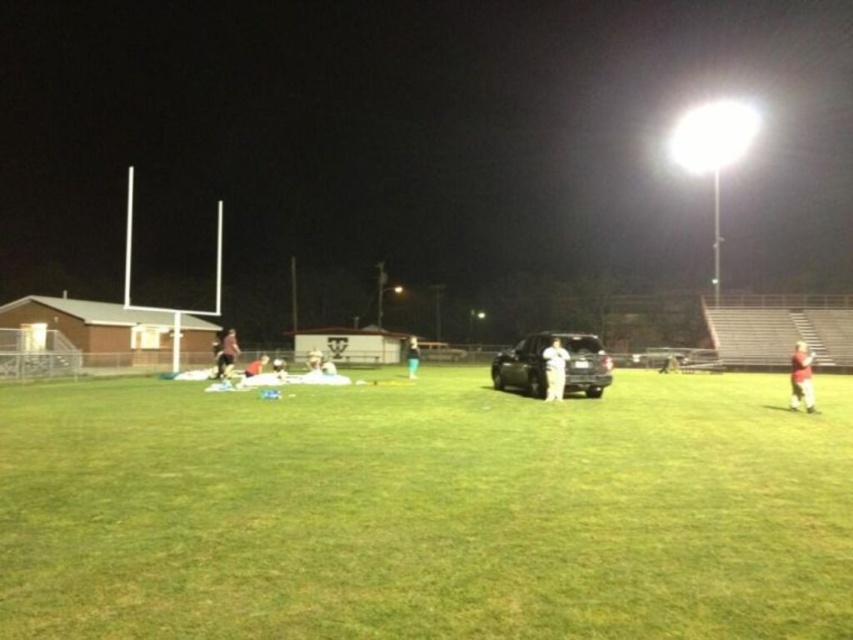
Which is in front, point (467, 48) or point (811, 397)?

Point (811, 397)

Does point (793, 33) come in front of point (799, 390)?

No.

Locate an element on the screen. This screenshot has width=853, height=640. metallic car at center is located at coordinates (416, 148).

Can you confirm if red jersey at right is shorter than orange fabric bag at center?

No, red jersey at right is not shorter than orange fabric bag at center.

Does red jersey at right appear on the left side of orange fabric bag at center?

Incorrect, red jersey at right is not on the left side of orange fabric bag at center.

Is point (793, 406) closer to viewer compared to point (245, 369)?

Yes, point (793, 406) is in front of point (245, 369).

Find the location of a particular element. red jersey at right is located at coordinates click(x=801, y=378).

Measure the distance between red shirt at lower left and camera.

22.27 meters

Is red shirt at lower left behind orange fabric bag at center?

No, it is not.

Which is behind, point (228, 353) or point (248, 369)?

Positioned behind is point (228, 353).

Where is `red shirt at lower left`? red shirt at lower left is located at coordinates (225, 353).